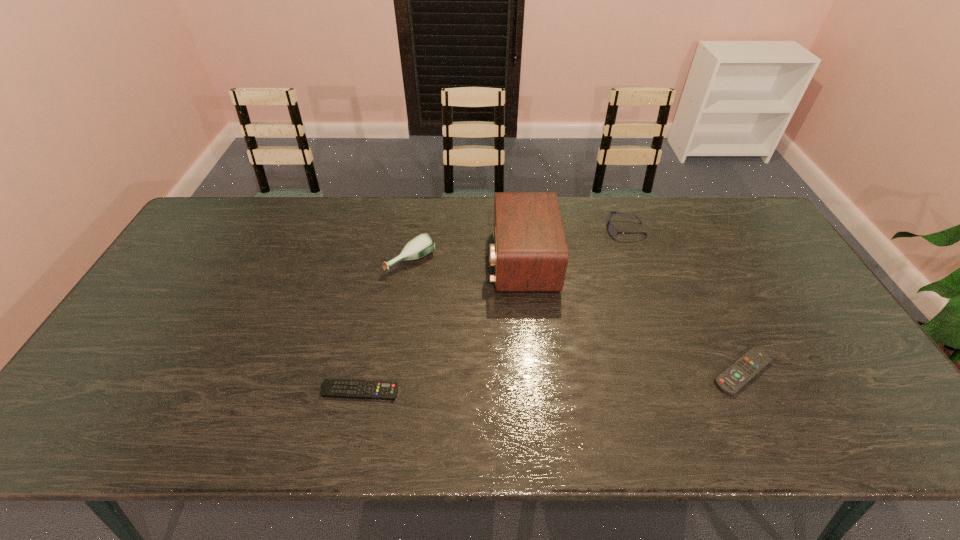
Where is `unoccupied area between the tallest object and the sunglasses`? This screenshot has width=960, height=540. unoccupied area between the tallest object and the sunglasses is located at coordinates (574, 245).

Where is `vacant area between the right remote control and the left remote control`? vacant area between the right remote control and the left remote control is located at coordinates (551, 381).

Choose which object is the third nearest neighbor to the left remote control. Please provide its 2D coordinates. Your answer should be formatted as a tuple, i.e. [(x, y)], where the tuple contains the x and y coordinates of a point satisfying the conditions above.

[(736, 376)]

This screenshot has height=540, width=960. What are the coordinates of `object that stands as the closest to the left remote control` in the screenshot? It's located at (422, 245).

Locate an element on the screen. free location that satisfies the following two spatial constraints: 1. on the lenses of the third shortest object; 2. on the right side of the rightmost object is located at coordinates (676, 372).

Where is `vacant region that satisfies the following two spatial constraints: 1. on the lenses of the fourth object from left to right; 2. on the front side of the bottle`? vacant region that satisfies the following two spatial constraints: 1. on the lenses of the fourth object from left to right; 2. on the front side of the bottle is located at coordinates (636, 260).